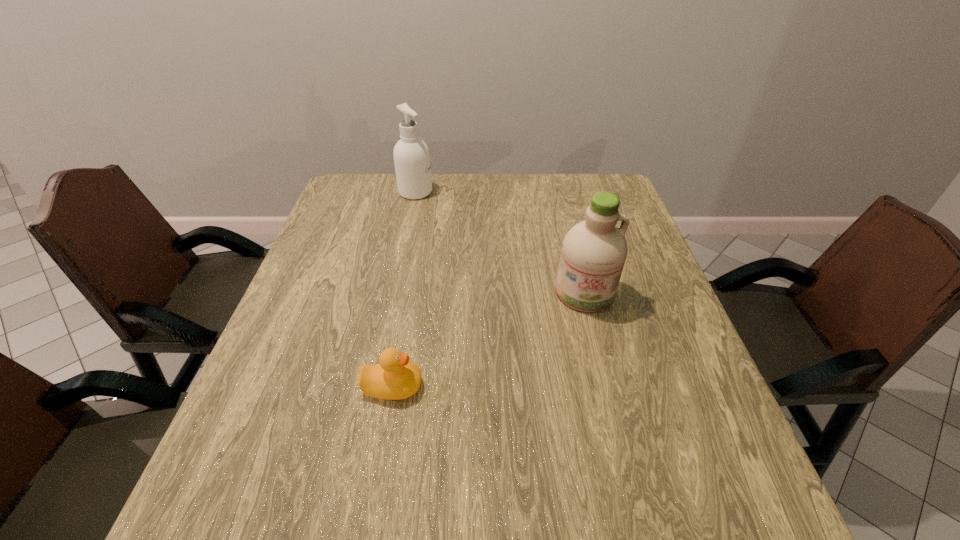
You are a GUI agent. You are given a task and a screenshot of the screen. Output one action in this format:
    pyautogui.click(x=<x>, y=<y>)
    Task: Click on the object situated at the right edge
    The image size is (960, 540).
    Given the screenshot: What is the action you would take?
    pyautogui.click(x=594, y=251)

Where is `free space at the far edge of the desktop`? This screenshot has height=540, width=960. free space at the far edge of the desktop is located at coordinates (438, 174).

Where is `free region at the near edge`? The width and height of the screenshot is (960, 540). free region at the near edge is located at coordinates (342, 485).

Identify the location of free space at the left edge of the desktop. (283, 329).

Find the location of a particular element. This screenshot has width=960, height=540. vacant space at the near left corner of the desktop is located at coordinates (276, 512).

Where is `free region at the far right corner`? The width and height of the screenshot is (960, 540). free region at the far right corner is located at coordinates (622, 211).

The image size is (960, 540). I want to click on blank space at the near right corner of the desktop, so click(x=738, y=498).

Where is `empty location between the right cleansing agent and the farther cleansing agent`? empty location between the right cleansing agent and the farther cleansing agent is located at coordinates (500, 242).

Locate an element on the screen. The image size is (960, 540). vacant space in between the nearest object and the rightmost object is located at coordinates (489, 340).

Locate an element on the screen. This screenshot has width=960, height=540. vacant area between the second nearest object and the farthest object is located at coordinates (500, 242).